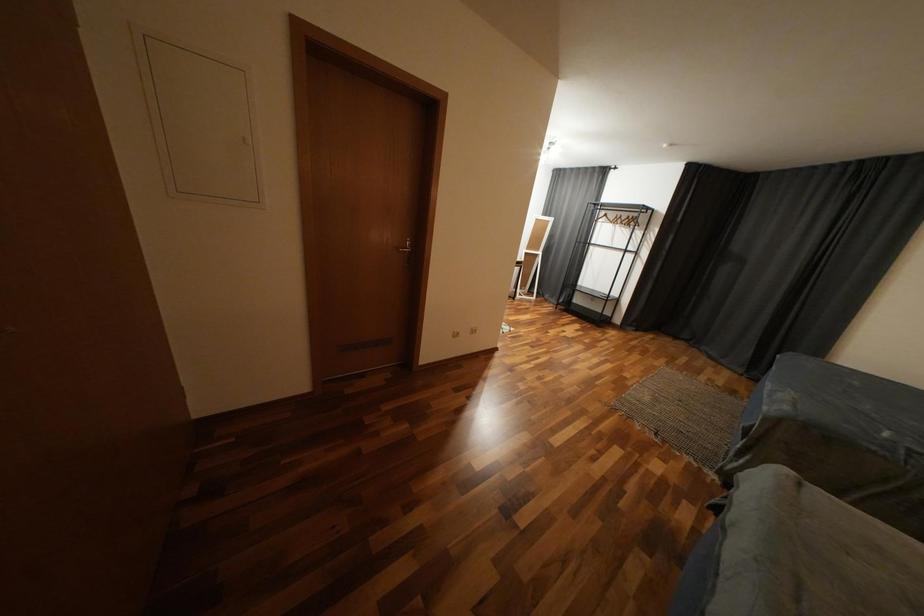
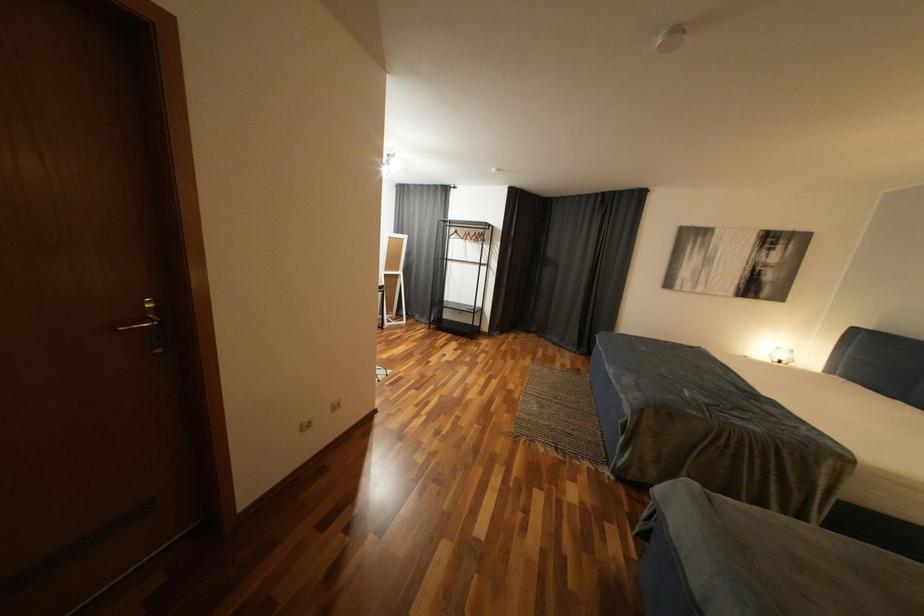
Question: The camera is either moving clockwise (left) or counter-clockwise (right) around the object. The first image is from the beginning of the video and the second image is from the end. Is the camera moving left or right when shooting the video?

Choices:
 (A) Left
 (B) Right

Answer: (A)